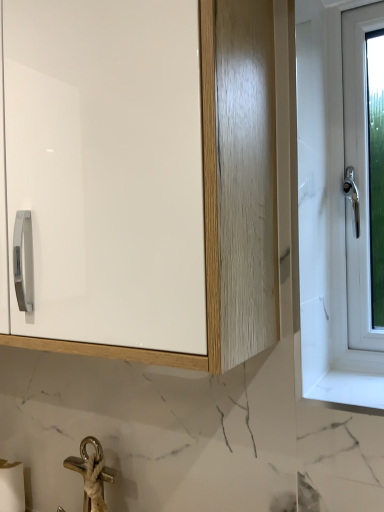
Question: Considering the relative sizes of white glossy cabinet at upper left and white matte toilet paper at lower left in the image provided, is white glossy cabinet at upper left thinner than white matte toilet paper at lower left?

Choices:
 (A) yes
 (B) no

Answer: (B)

Question: Does white glossy cabinet at upper left appear on the left side of white matte toilet paper at lower left?

Choices:
 (A) no
 (B) yes

Answer: (A)

Question: Is white glossy cabinet at upper left closer to camera compared to white matte toilet paper at lower left?

Choices:
 (A) no
 (B) yes

Answer: (B)

Question: Is white glossy cabinet at upper left completely or partially outside of white matte toilet paper at lower left?

Choices:
 (A) yes
 (B) no

Answer: (A)

Question: Can you confirm if white glossy cabinet at upper left is bigger than white matte toilet paper at lower left?

Choices:
 (A) yes
 (B) no

Answer: (A)

Question: Does white glossy cabinet at upper left have a smaller size compared to white matte toilet paper at lower left?

Choices:
 (A) yes
 (B) no

Answer: (B)

Question: Are white matte toilet paper at lower left and white glossy cabinet at upper left located far from each other?

Choices:
 (A) yes
 (B) no

Answer: (B)

Question: Is white matte toilet paper at lower left thinner than white glossy cabinet at upper left?

Choices:
 (A) yes
 (B) no

Answer: (A)

Question: From a real-world perspective, is white matte toilet paper at lower left physically above white glossy cabinet at upper left?

Choices:
 (A) yes
 (B) no

Answer: (B)

Question: From the image's perspective, is white matte toilet paper at lower left located beneath white glossy cabinet at upper left?

Choices:
 (A) no
 (B) yes

Answer: (B)

Question: Can you confirm if white matte toilet paper at lower left is wider than white glossy cabinet at upper left?

Choices:
 (A) yes
 (B) no

Answer: (B)

Question: Are white matte toilet paper at lower left and white glossy cabinet at upper left making contact?

Choices:
 (A) no
 (B) yes

Answer: (A)

Question: From a real-world perspective, relative to white glossy cabinet at upper left, is white matte toilet paper at lower left vertically above or below?

Choices:
 (A) below
 (B) above

Answer: (A)